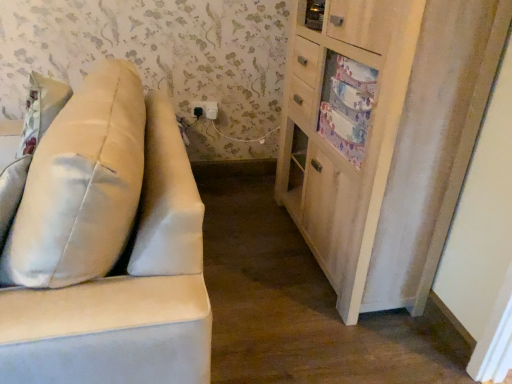
Question: From a real-world perspective, relative to black plastic electric outlet at upper center, is suede-like beige sofa at left vertically above or below?

Choices:
 (A) below
 (B) above

Answer: (A)

Question: Considering the positions of suede-like beige sofa at left and black plastic electric outlet at upper center in the image, is suede-like beige sofa at left bigger or smaller than black plastic electric outlet at upper center?

Choices:
 (A) big
 (B) small

Answer: (A)

Question: Estimate the real-world distances between objects in this image. Which object is farther from the black plastic electric outlet at upper center?

Choices:
 (A) satin beige pillow at left
 (B) satin beige pillow at left
 (C) suede-like beige sofa at left
 (D) light wood cabinet at right

Answer: (C)

Question: Which is farther from the black plastic electric outlet at upper center?

Choices:
 (A) suede-like beige sofa at left
 (B) satin beige pillow at left
 (C) light wood cabinet at right
 (D) satin beige pillow at left

Answer: (A)